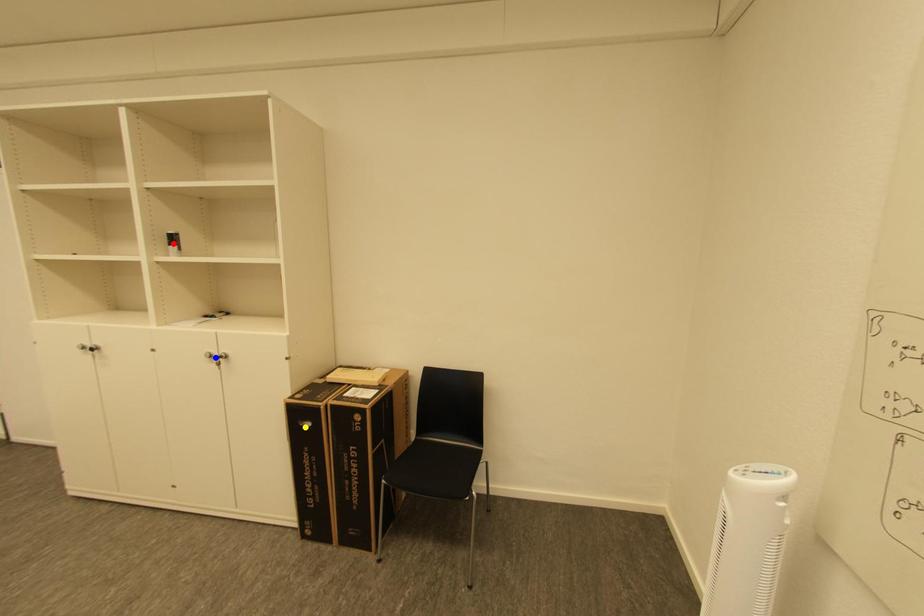
Order these from nearest to farthest:
- yellow point
- red point
- blue point

yellow point
blue point
red point